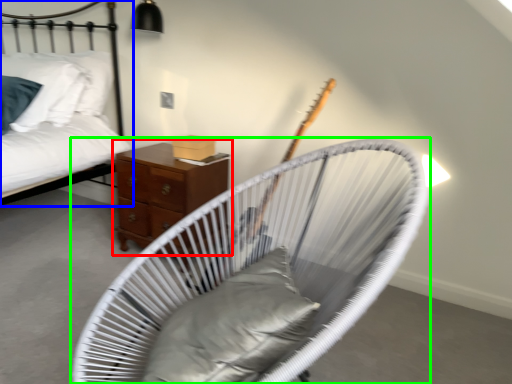
Question: Estimate the real-world distances between objects in this image. Which object is farther from nightstand (highlighted by a red box), bed (highlighted by a blue box) or furniture (highlighted by a green box)?

Choices:
 (A) bed
 (B) furniture

Answer: (B)